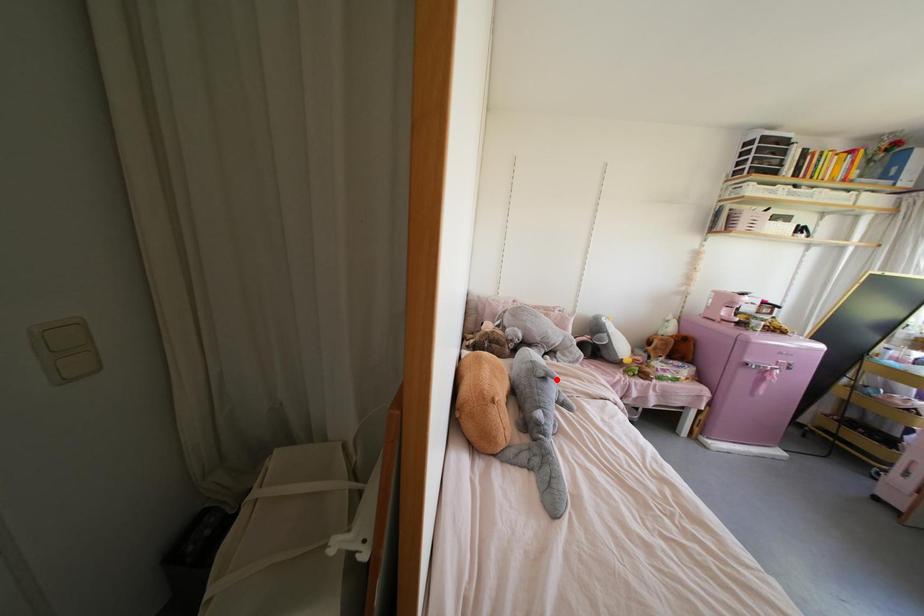
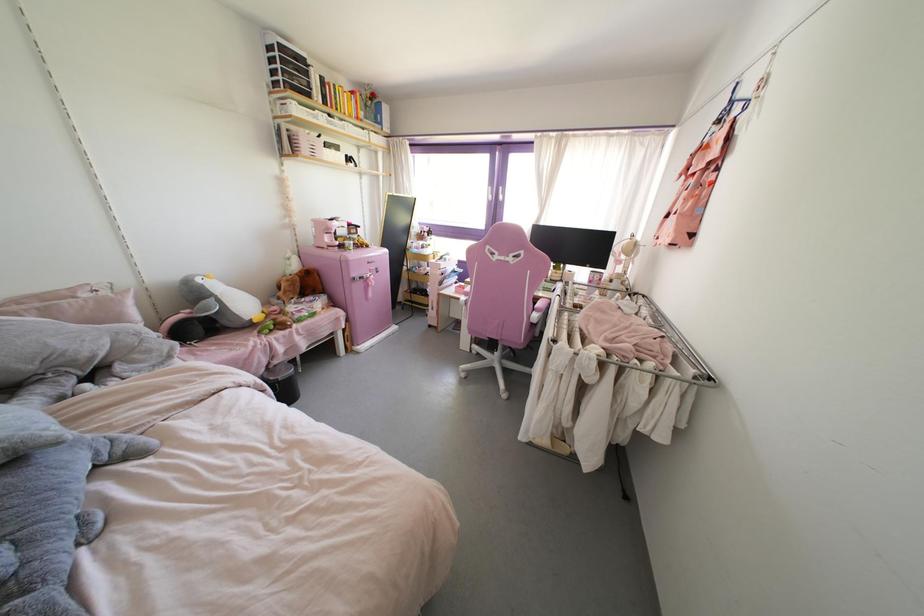
Locate, in the second image, the point that corresponds to the highlighted location in the first image.

(57, 442)